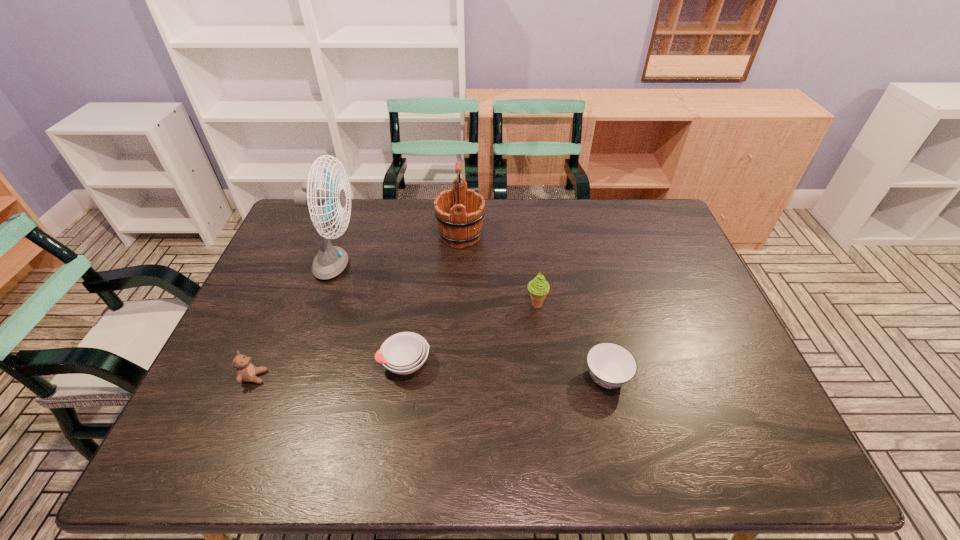
Find the location of `fan`. fan is located at coordinates (330, 261).

At what (x,y) coordinates should I click in order to perform the action: click on the second object from left to right. Please return your answer as a coordinate pair (x, y). Looking at the image, I should click on (330, 261).

Image resolution: width=960 pixels, height=540 pixels. In order to click on the fifth shortest object in this screenshot , I will do `click(459, 211)`.

The width and height of the screenshot is (960, 540). Identify the location of icecream. (538, 287).

Where is `the third tallest object`? This screenshot has height=540, width=960. the third tallest object is located at coordinates (538, 287).

The width and height of the screenshot is (960, 540). Identify the location of the third shortest object. (245, 371).

At what (x,y) coordinates should I click in order to perform the action: click on teddy bear. Please return your answer as a coordinate pair (x, y). Looking at the image, I should click on point(245,371).

You are a GUI agent. You are given a task and a screenshot of the screen. Output one action in this format:
    pyautogui.click(x=<x>, y=<y>)
    Task: Click on the rightmost object
    The image size is (960, 540).
    Given the screenshot: What is the action you would take?
    pyautogui.click(x=610, y=365)

At what (x,y) coordinates should I click in order to perform the action: click on the left soup bowl. Please return your answer as a coordinate pair (x, y). Image resolution: width=960 pixels, height=540 pixels. Looking at the image, I should click on (403, 353).

Where is `vacant area located on the front-facing side of the tallest object`? This screenshot has height=540, width=960. vacant area located on the front-facing side of the tallest object is located at coordinates (421, 267).